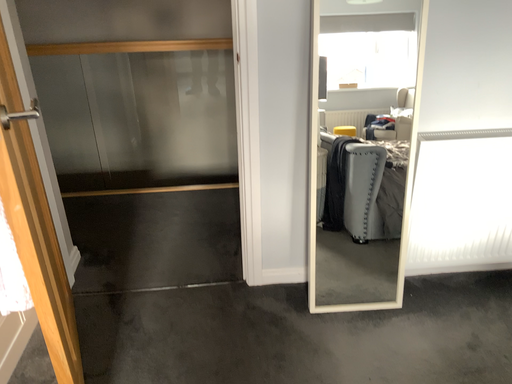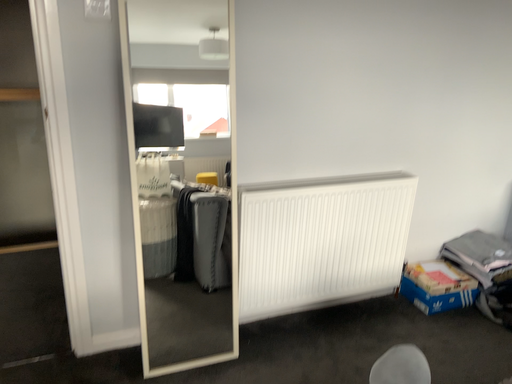
Question: How did the camera likely rotate when shooting the video?

Choices:
 (A) rotated right
 (B) rotated left

Answer: (A)